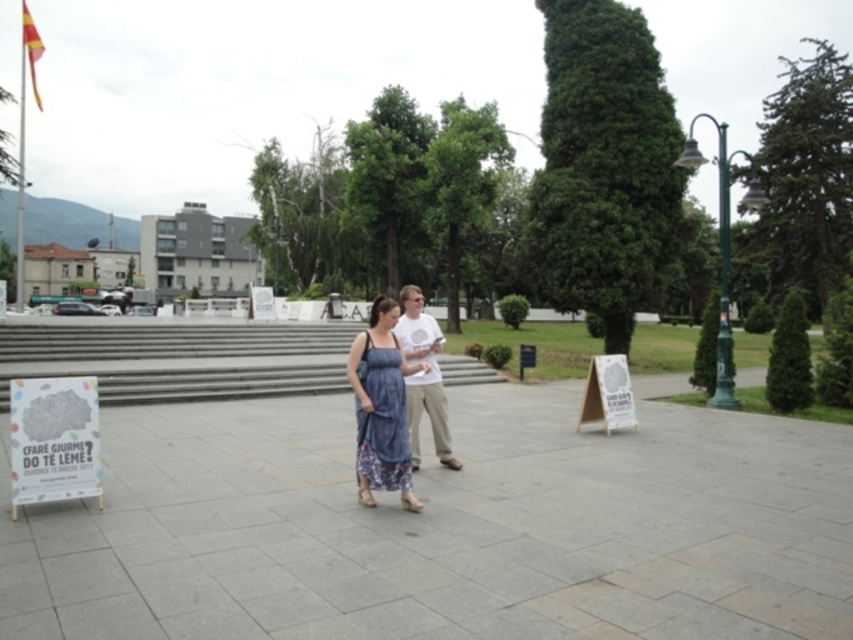
Between dusty blue floral dress at center and white cotton t-shirt at center, which one appears on the right side from the viewer's perspective?

white cotton t-shirt at center is more to the right.

Does point (363, 429) come farther from viewer compared to point (409, 401)?

No, it is not.

You are a GUI agent. You are given a task and a screenshot of the screen. Output one action in this format:
    pyautogui.click(x=<x>, y=<y>)
    Task: Click on the dusty blue floral dress at center
    The image size is (853, 640).
    Given the screenshot: What is the action you would take?
    pyautogui.click(x=381, y=420)

Which is more to the right, denim dress at center or dusty blue floral dress at center?

From the viewer's perspective, dusty blue floral dress at center appears more on the right side.

Who is shorter, denim dress at center or dusty blue floral dress at center?

dusty blue floral dress at center

Is point (408, 452) positioned behind point (370, 436)?

Yes, point (408, 452) is farther from viewer.

You are a GUI agent. You are given a task and a screenshot of the screen. Output one action in this format:
    pyautogui.click(x=<x>, y=<y>)
    Task: Click on the denim dress at center
    
    Given the screenshot: What is the action you would take?
    pyautogui.click(x=381, y=403)

Does denim dress at center come in front of white cotton t-shirt at center?

That is True.

Where is `denim dress at center`? This screenshot has height=640, width=853. denim dress at center is located at coordinates (381, 403).

At what (x,y) coordinates should I click in order to perform the action: click on denim dress at center. Please return your answer as a coordinate pair (x, y). Looking at the image, I should click on (381, 403).

Identify the location of denim dress at center. (381, 403).